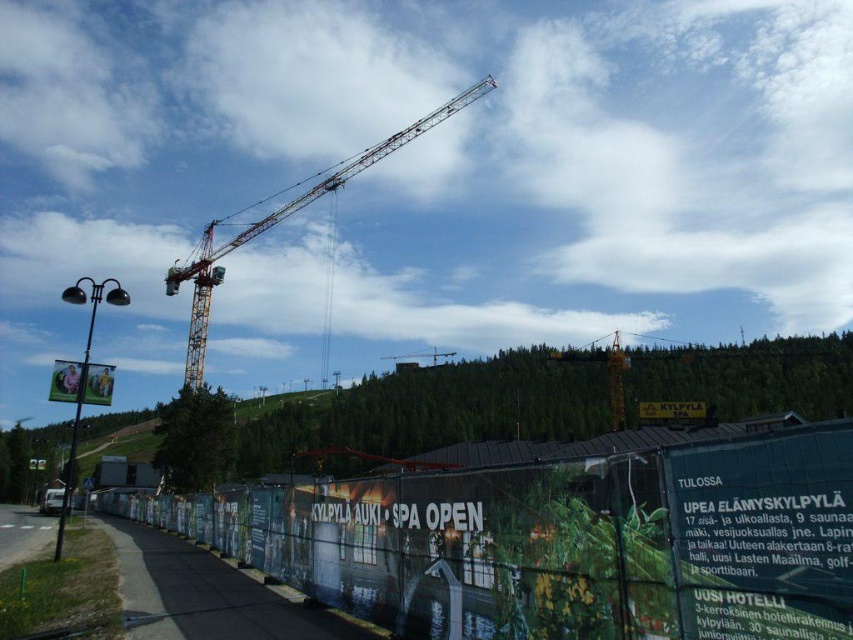
From the picture: You are a visitor approaching the construction site from the front. You see the green fabric fence at lower center and the yellow metallic crane at center. Which object is taller?

The green fabric fence at lower center is much taller than the yellow metallic crane at center.

You are a construction worker who needs to install a new flagpole that must be 2 meters tall. You are standing near the red plastic sign at center. Looking at the yellow metallic crane at upper center, can you tell if the flagpole will be shorter than the crane?

The yellow metallic crane at upper center is taller than the red plastic sign at center. Since the flagpole is only 2 meters tall and the crane is taller than the sign, the flagpole will definitely be shorter than the crane.

You are a drone operator tasked with capturing aerial footage of the construction site. The green fabric fence at lower center and the yellow metallic crane at center are both in your shot. If your drone can only maintain a stable flight within a 300 meter radius, will you need to adjust your position to keep both objects in frame?

The green fabric fence at lower center and the yellow metallic crane at center are 343.61 meters apart, which exceeds the 300 meter radius limit. Therefore, you will need to adjust your position to keep both objects in frame.